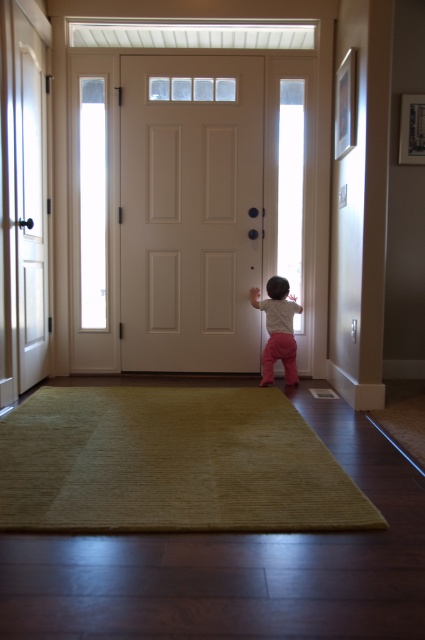
Does white matte door at center have a lesser width compared to pink fabric toddler at center?

Incorrect, white matte door at center's width is not less than pink fabric toddler at center's.

Is white matte door at center wider than pink fabric toddler at center?

Yes.

Does point (136, 356) come closer to viewer compared to point (271, 308)?

No, it is behind (271, 308).

What are the coordinates of `white matte door at center` in the screenshot? It's located at (190, 212).

Is green soft rug at center bigger than pink fabric toddler at center?

Correct, green soft rug at center is larger in size than pink fabric toddler at center.

Does green soft rug at center appear on the left side of pink fabric toddler at center?

Correct, you'll find green soft rug at center to the left of pink fabric toddler at center.

The image size is (425, 640). In order to click on green soft rug at center in this screenshot , I will do `click(170, 464)`.

Between green soft rug at center and white matte door at center, which one appears on the right side from the viewer's perspective?

From the viewer's perspective, white matte door at center appears more on the right side.

Does green soft rug at center have a greater width compared to white matte door at center?

Indeed, green soft rug at center has a greater width compared to white matte door at center.

Measure the distance between point (56,500) and camera.

A distance of 5.95 feet exists between point (56,500) and camera.

Locate an element on the screen. The height and width of the screenshot is (640, 425). green soft rug at center is located at coordinates (170, 464).